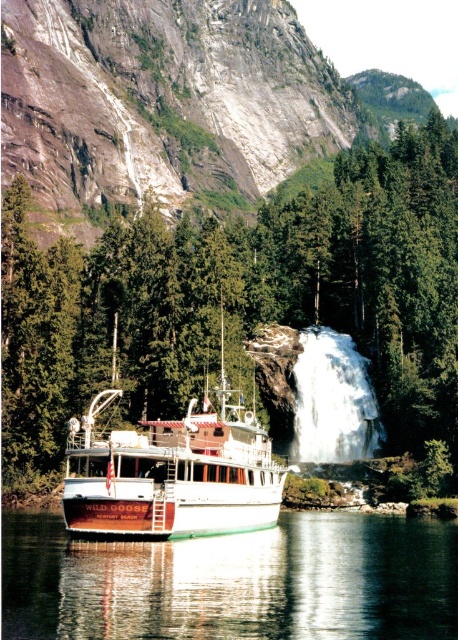
Question: From the image, what is the correct spatial relationship of green textured tree at center in relation to white frothy water at center?

Choices:
 (A) right
 (B) left

Answer: (B)

Question: In this image, where is green textured tree at center located relative to white frothy water at center?

Choices:
 (A) right
 (B) left

Answer: (B)

Question: Is green textured tree at center in front of green reflective water at lower center?

Choices:
 (A) yes
 (B) no

Answer: (B)

Question: Which object is positioned closest to the white matte cruise ship at center?

Choices:
 (A) white frothy water at center
 (B) green reflective water at lower center

Answer: (B)

Question: Which point is farther from the camera taking this photo?

Choices:
 (A) (30, 634)
 (B) (339, 388)

Answer: (B)

Question: Which of the following is the closest to the observer?

Choices:
 (A) green reflective water at lower center
 (B) white matte cruise ship at center
 (C) white frothy water at center
 (D) green textured tree at center

Answer: (A)